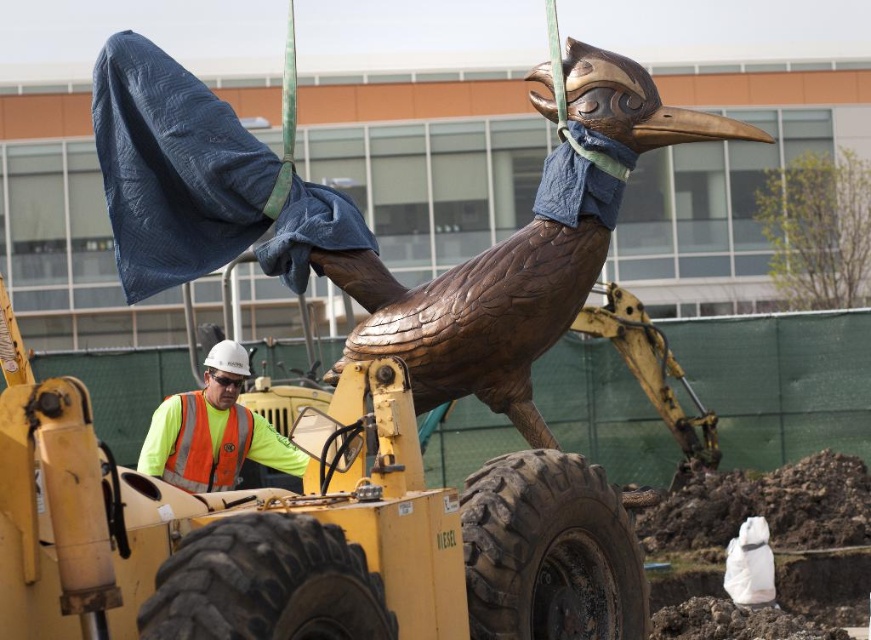
You are a construction worker at the site. You need to place a safety barrier around the bronze sculpture at center. The barrier requires a minimum of 2 meters of clearance from the sculpture in all directions. Given the coordinates of the bronze sculpture at center at point (369,230), can you confirm if there is enough space to install the barrier without encroaching on the yellow front end loader or the modern building in the background?

The bronze sculpture at center is located at point (369,230). To install the safety barrier with 2 meters clearance, ensure there is sufficient space around this point without overlapping the yellow front end loader or the modern building in the background. Check the surrounding area for obstructions before proceeding.

You are standing at the point with coordinates point (194, 568) and want to walk to the point with coordinates point (552, 552). Based on the scene description, which direction should you move to reach your destination?

You should move backward because point (552, 552) is behind point (194, 568).